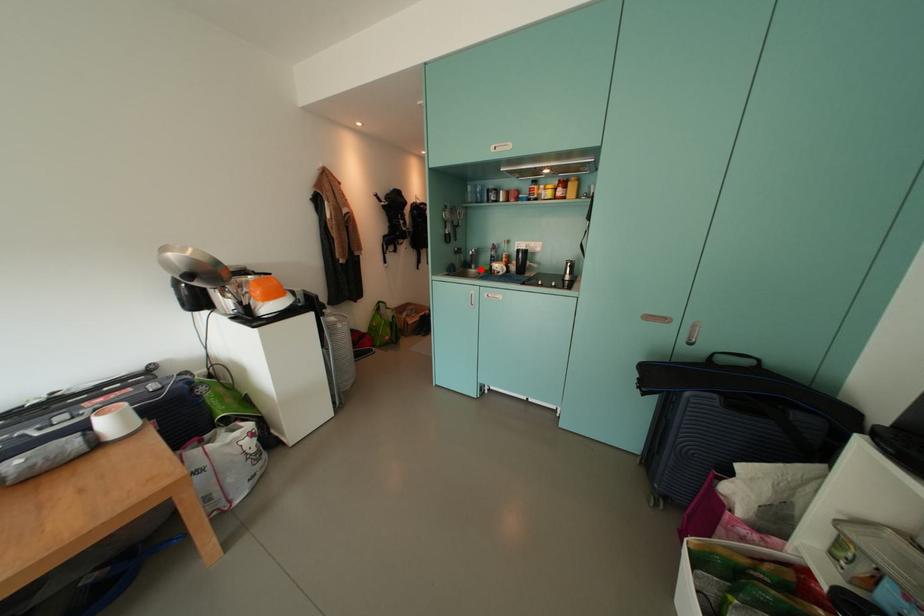
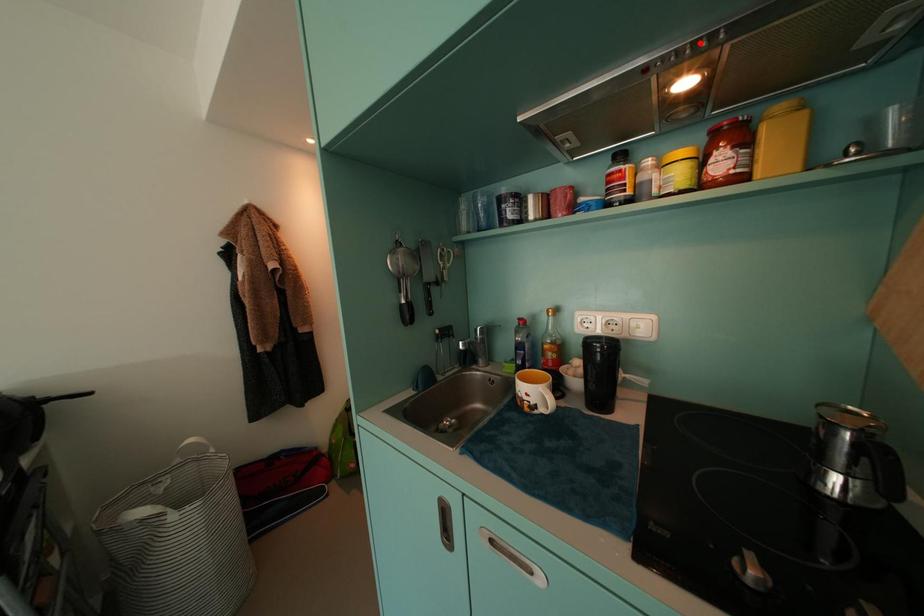
I am providing you with two images of the same scene from different viewpoints. A red point is marked on the first image and another point is marked on the second image. Does the point marked in image1 correspond to the same location as the one in image2?

No